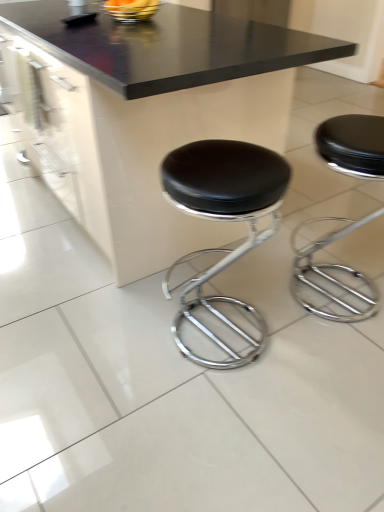
Question: Is the depth of black leather stool at center, the first stool in the left-to-right sequence, less than that of black leather stool at center, acting as the first stool starting from the right?

Choices:
 (A) no
 (B) yes

Answer: (B)

Question: Considering the relative sizes of black leather stool at center, the second stool positioned from the right, and black leather stool at center, acting as the first stool starting from the right, in the image provided, is black leather stool at center, the second stool positioned from the right, shorter than black leather stool at center, acting as the first stool starting from the right,?

Choices:
 (A) yes
 (B) no

Answer: (A)

Question: From a real-world perspective, does black leather stool at center, the second stool positioned from the right, stand above black leather stool at center, acting as the 2th stool starting from the left?

Choices:
 (A) yes
 (B) no

Answer: (A)

Question: Can you confirm if black leather stool at center, the second stool positioned from the right, is thinner than black leather stool at center, acting as the 2th stool starting from the left?

Choices:
 (A) no
 (B) yes

Answer: (B)

Question: Does black leather stool at center, the first stool in the left-to-right sequence, have a greater width compared to black leather stool at center, acting as the 2th stool starting from the left?

Choices:
 (A) yes
 (B) no

Answer: (B)

Question: Is black leather stool at center, the second stool positioned from the right, far away from black leather stool at center, acting as the 2th stool starting from the left?

Choices:
 (A) no
 (B) yes

Answer: (A)

Question: From the image's perspective, is black leather stool at center, acting as the 2th stool starting from the left, on top of black glossy table at center?

Choices:
 (A) no
 (B) yes

Answer: (A)

Question: Is black leather stool at center, acting as the 2th stool starting from the left, positioned behind black glossy table at center?

Choices:
 (A) yes
 (B) no

Answer: (A)

Question: From the image's perspective, is black leather stool at center, acting as the 2th stool starting from the left, beneath black glossy table at center?

Choices:
 (A) yes
 (B) no

Answer: (A)

Question: Is black glossy table at center at the back of black leather stool at center, acting as the first stool starting from the right?

Choices:
 (A) yes
 (B) no

Answer: (B)

Question: Considering the relative positions of black leather stool at center, acting as the 2th stool starting from the left, and black glossy table at center in the image provided, is black leather stool at center, acting as the 2th stool starting from the left, in front of black glossy table at center?

Choices:
 (A) no
 (B) yes

Answer: (A)

Question: From a real-world perspective, is black leather stool at center, acting as the 2th stool starting from the left, located higher than black glossy table at center?

Choices:
 (A) no
 (B) yes

Answer: (A)

Question: Would you say black leather stool at center, the first stool in the left-to-right sequence, is part of metallic silver bowl at upper center's contents?

Choices:
 (A) no
 (B) yes

Answer: (A)